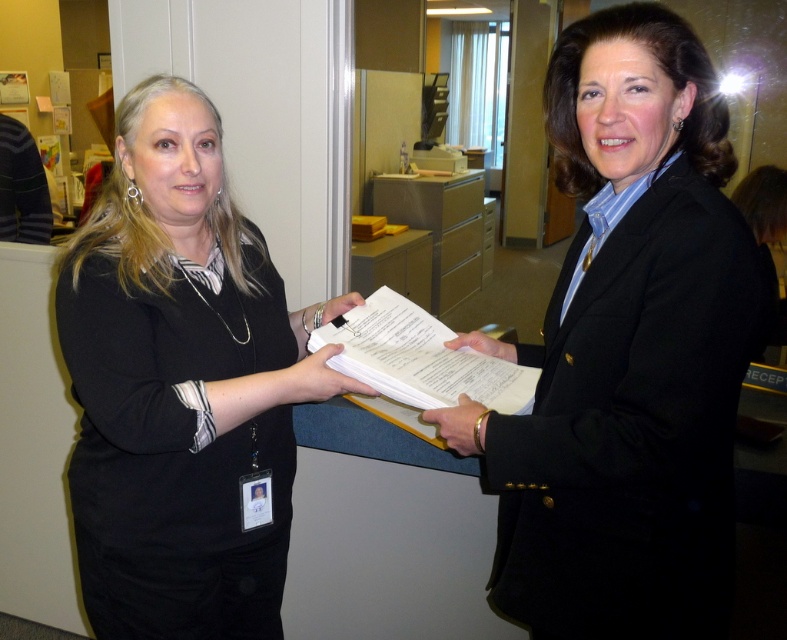
Question: Which point is farther to the camera?

Choices:
 (A) black matte blazer at center
 (B) matte black shirt at center

Answer: (B)

Question: Which point appears farthest from the camera in this image?

Choices:
 (A) (527, 573)
 (B) (124, 280)

Answer: (A)

Question: Does black matte blazer at center have a lesser width compared to matte black shirt at center?

Choices:
 (A) yes
 (B) no

Answer: (A)

Question: Where is black matte blazer at center located in relation to matte black shirt at center in the image?

Choices:
 (A) below
 (B) above

Answer: (B)

Question: Which point appears closest to the camera in this image?

Choices:
 (A) (202, 540)
 (B) (634, 330)

Answer: (B)

Question: Is black matte blazer at center above matte black shirt at center?

Choices:
 (A) yes
 (B) no

Answer: (A)